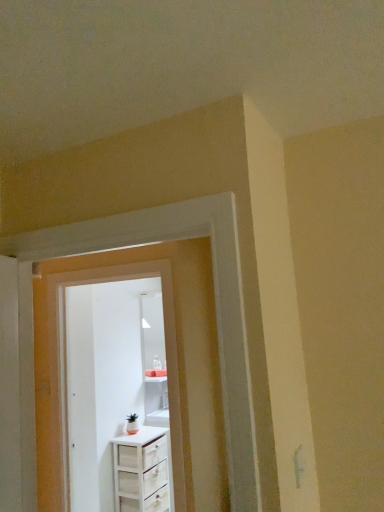
Question: Is white wood door at center, the first door from the back, taller or shorter than white wood chest of drawers at center?

Choices:
 (A) short
 (B) tall

Answer: (B)

Question: Looking at the image, does white wood door at center, the first door from the back, seem bigger or smaller compared to white wood chest of drawers at center?

Choices:
 (A) small
 (B) big

Answer: (A)

Question: Considering the real-world distances, which object is farthest from the white wood chest of drawers at center?

Choices:
 (A) white wood door at center, the first door from the back
 (B) white glossy door at center, the second door positioned from the back

Answer: (B)

Question: Which object is positioned closest to the white wood chest of drawers at center?

Choices:
 (A) white glossy door at center, the 1th door in the front-to-back sequence
 (B) white wood door at center, the second door viewed from the front

Answer: (B)